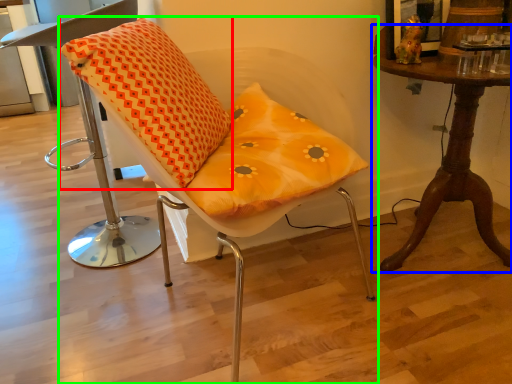
Question: Which object is the farthest from throw pillow (highlighted by a red box)? Choose among these: table (highlighted by a blue box) or chair (highlighted by a green box).

Choices:
 (A) table
 (B) chair

Answer: (A)